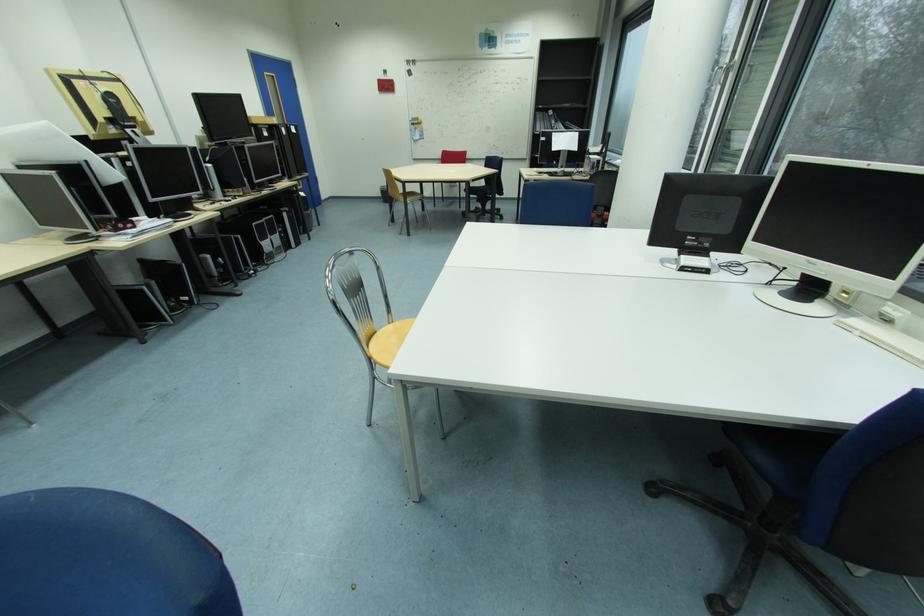
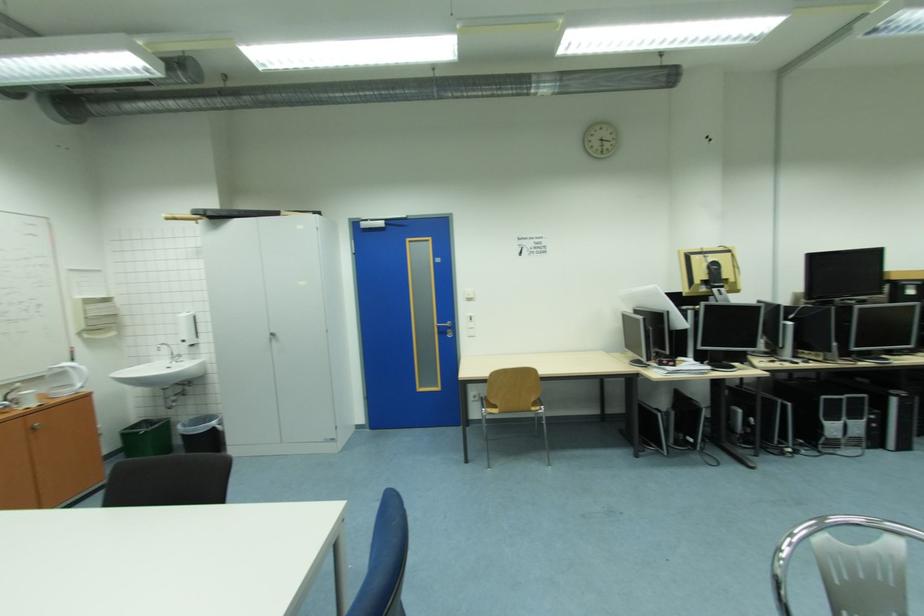
The point at (149, 292) is marked in the first image. Where is the corresponding point in the second image?

(663, 416)